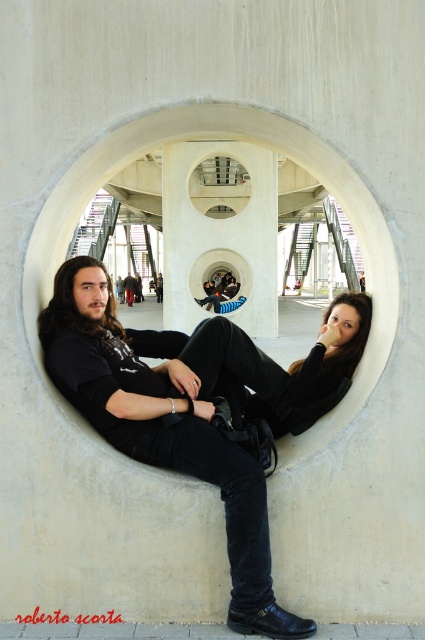
Question: Which point is farther to the camera?

Choices:
 (A) (263, 588)
 (B) (158, 285)
 (C) (201, 461)

Answer: (B)

Question: Which of the following is the closest to the observer?

Choices:
 (A) (166, 464)
 (B) (254, 476)

Answer: (B)

Question: Observing the image, what is the correct spatial positioning of smooth black hair at center in reference to concrete/smooth hole at center?

Choices:
 (A) right
 (B) left

Answer: (A)

Question: Observing the image, what is the correct spatial positioning of black leather jacket at center in reference to black matte jacket at center?

Choices:
 (A) above
 (B) below

Answer: (A)

Question: Which object is the farthest from the matte black jacket at center?

Choices:
 (A) matte concrete hole at center
 (B) black leather jacket at center
 (C) matte black hair at center

Answer: (C)

Question: Is concrete/smooth hole at center wider than matte black hair at center?

Choices:
 (A) no
 (B) yes

Answer: (B)